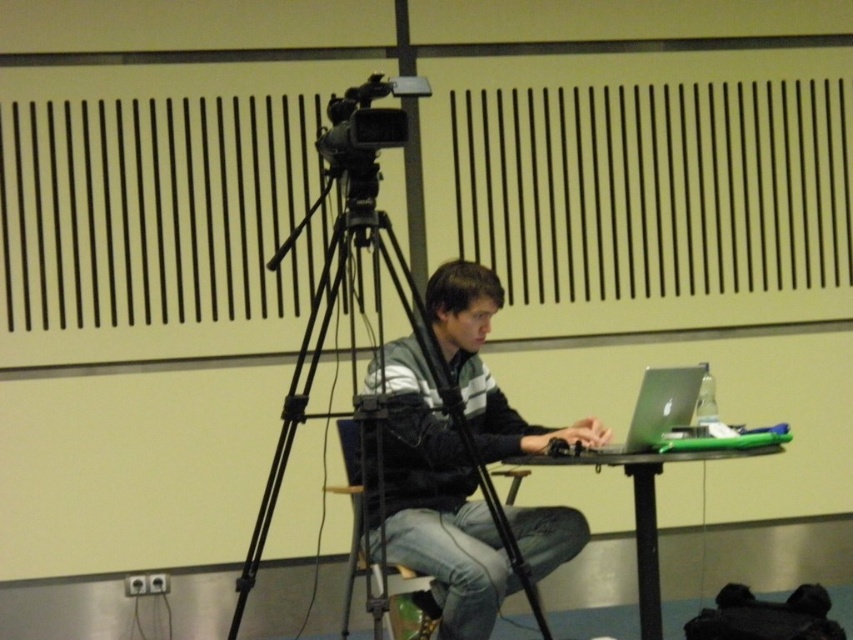
Does black matte tripod at center appear on the right side of black plastic video camera at upper center?

Incorrect, black matte tripod at center is not on the right side of black plastic video camera at upper center.

Who is positioned more to the left, black matte tripod at center or black plastic video camera at upper center?

black matte tripod at center

Where is `black matte tripod at center`? This screenshot has width=853, height=640. black matte tripod at center is located at coordinates tap(373, 355).

Is matte black jacket at center smaller than denim at center?

No, matte black jacket at center is not smaller than denim at center.

Is matte black jacket at center shorter than denim at center?

No, matte black jacket at center is not shorter than denim at center.

Identify the location of matte black jacket at center. (434, 499).

Is point (300, 227) in front of point (672, 420)?

Yes, point (300, 227) is in front of point (672, 420).

Which is behind, point (300, 392) or point (631, 442)?

The point (300, 392) is more distant.

Is point (325, 168) less distant than point (637, 394)?

That is False.

Where is `black matte tripod at center`? The height and width of the screenshot is (640, 853). black matte tripod at center is located at coordinates (373, 355).